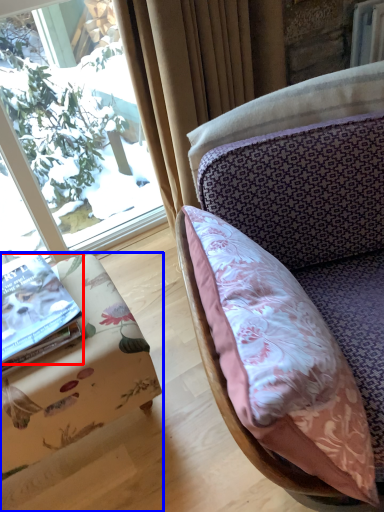
Question: Which object is closer to the camera taking this photo, book (highlighted by a red box) or furniture (highlighted by a blue box)?

Choices:
 (A) book
 (B) furniture

Answer: (B)